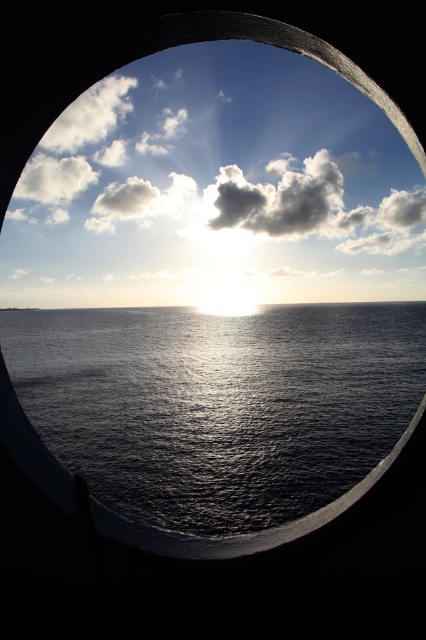
Can you confirm if glistening dark water at center is positioned below white fluffy cloud at upper center?

Yes.

Locate an element on the screen. The height and width of the screenshot is (640, 426). glistening dark water at center is located at coordinates (218, 403).

Is point (69, 118) farther from viewer compared to point (296, 496)?

Yes, point (69, 118) is farther from viewer.

Between point (164, 209) and point (262, 364), which one is positioned behind?

Positioned behind is point (164, 209).

Is point (36, 202) less distant than point (40, 428)?

No, (36, 202) is further to viewer.

Where is `cloudy sky at upper center`? This screenshot has height=640, width=426. cloudy sky at upper center is located at coordinates (215, 188).

Can you confirm if cloudy sky at upper center is positioned above white fluffy cloud at upper center?

Incorrect, cloudy sky at upper center is not positioned above white fluffy cloud at upper center.

Is point (250, 68) farther from camera compared to point (270, 211)?

Yes, point (250, 68) is behind point (270, 211).

Measure the distance between point (176,131) and camera.

They are 2017.97 feet apart.

The height and width of the screenshot is (640, 426). Find the location of `cloudy sky at upper center`. cloudy sky at upper center is located at coordinates (215, 188).